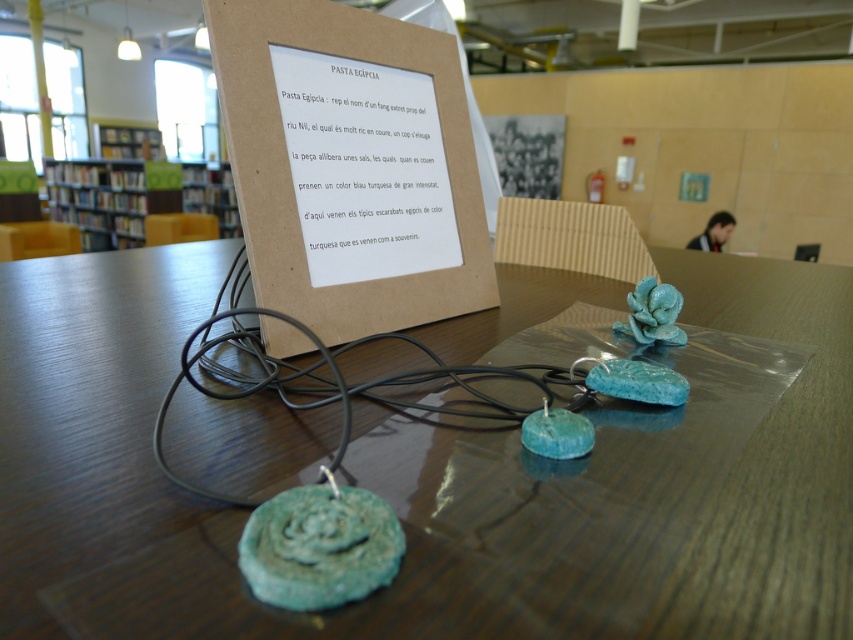
Question: Is shiny brown table at center in front of black wire at center?

Choices:
 (A) yes
 (B) no

Answer: (A)

Question: From the image, what is the correct spatial relationship of shiny brown table at center in relation to black wire at center?

Choices:
 (A) right
 (B) left

Answer: (A)

Question: Among these points, which one is nearest to the camera?

Choices:
 (A) (241, 342)
 (B) (260, 424)

Answer: (B)

Question: Which point appears farthest from the camera in this image?

Choices:
 (A) (209, 492)
 (B) (461, 556)

Answer: (A)

Question: Which of the following is the closest to the observer?

Choices:
 (A) (287, 406)
 (B) (505, 333)

Answer: (A)

Question: Is shiny brown table at center closer to the viewer compared to black wire at center?

Choices:
 (A) yes
 (B) no

Answer: (A)